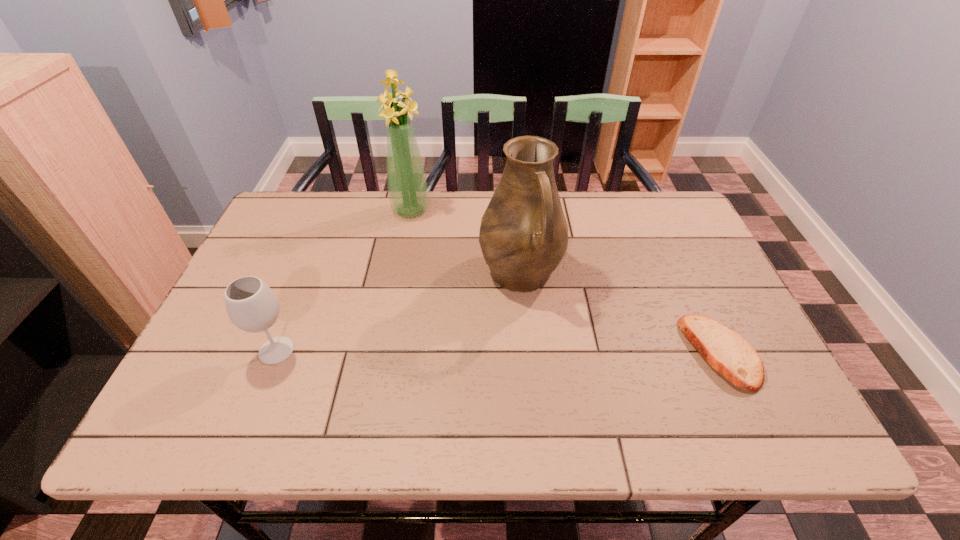
At what (x,y) coordinates should I click in order to perform the action: click on the leftmost object. Please return your answer as a coordinate pair (x, y). Looking at the image, I should click on click(252, 306).

Locate an element on the screen. Image resolution: width=960 pixels, height=540 pixels. the third tallest object is located at coordinates (252, 306).

Locate an element on the screen. This screenshot has width=960, height=540. the rightmost object is located at coordinates (726, 351).

Locate an element on the screen. the shortest object is located at coordinates (726, 351).

The image size is (960, 540). I want to click on the farthest object, so click(x=408, y=192).

Locate an element on the screen. bouquet is located at coordinates (408, 192).

Identify the location of the second farthest object. This screenshot has width=960, height=540. (523, 236).

The width and height of the screenshot is (960, 540). What are the coordinates of `the third object from left to right` in the screenshot? It's located at (523, 236).

Where is `vacant space located on the right of the leftmost object`? The height and width of the screenshot is (540, 960). vacant space located on the right of the leftmost object is located at coordinates (337, 350).

Identify the location of free space located on the back of the pita bread. This screenshot has width=960, height=540. (675, 254).